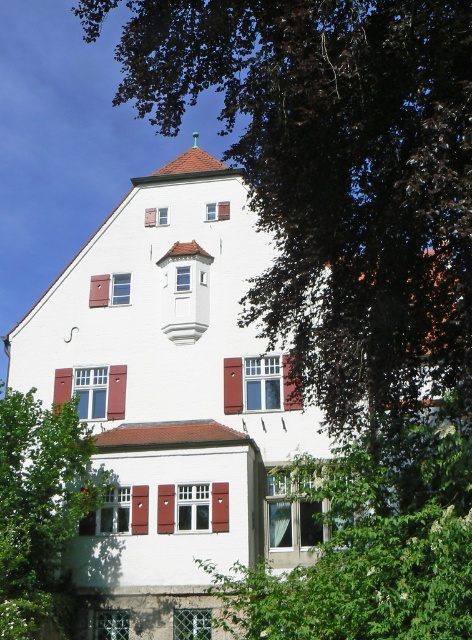
You are an architect reviewing the design of a two story building. You notice two shutters on the building facade, a brown wooden shutter at center and a matte wood shutter at center. Which one has a bigger size?

The brown wooden shutter at center is larger in size than the matte wood shutter at center.

You are standing in front of a two story building with a European style. You see a point marked at coordinates (115, 509). What object is located at this point?

The point at coordinates (115, 509) indicates the location of the red wood shutter at lower center.